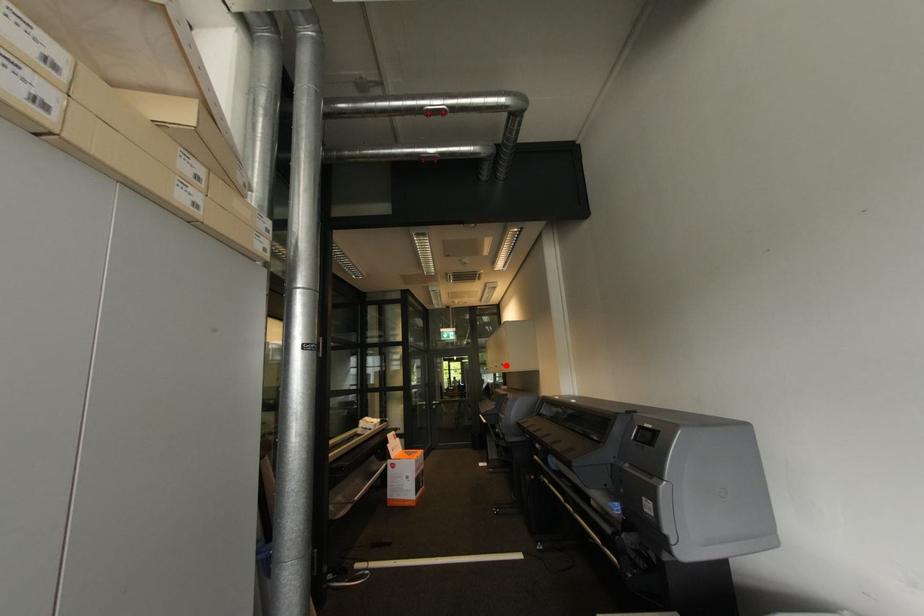
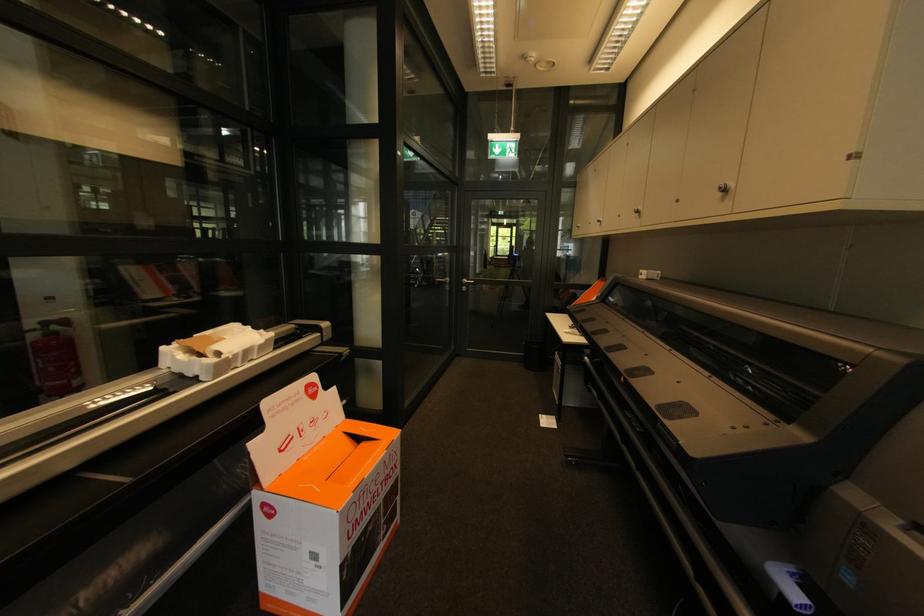
Where in the second image is the point corresponding to the highlighted location from the first image?

(727, 191)